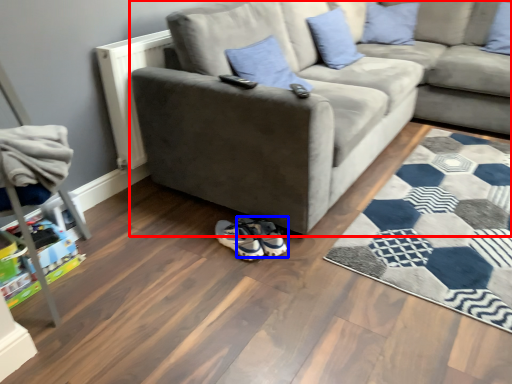
Question: Which point is further to the camera, studio couch (highlighted by a red box) or footwear (highlighted by a blue box)?

Choices:
 (A) studio couch
 (B) footwear

Answer: (B)